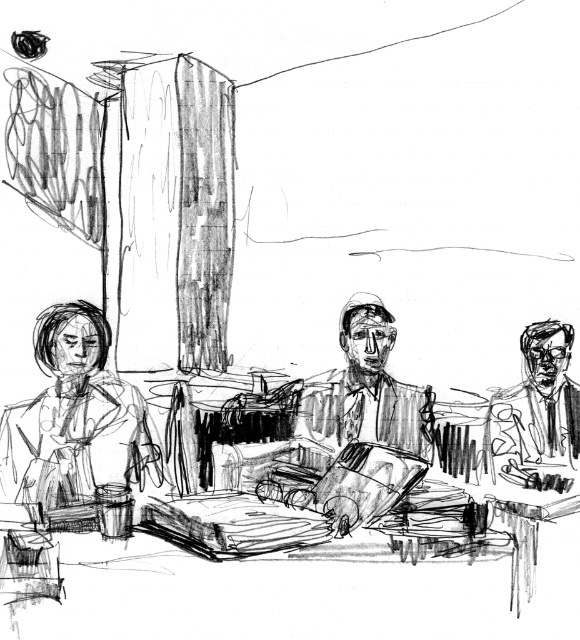
Question: Does smooth brown leather jacket at center lie behind smooth black suit at right?

Choices:
 (A) no
 (B) yes

Answer: (A)

Question: Considering the relative positions of smooth skin woman at left and smooth black suit at right in the image provided, where is smooth skin woman at left located with respect to smooth black suit at right?

Choices:
 (A) above
 (B) below

Answer: (B)

Question: Which point is closer to the camera?

Choices:
 (A) smooth brown leather jacket at center
 (B) smooth skin woman at left

Answer: (B)

Question: Which of the following is the farthest from the observer?

Choices:
 (A) smooth black suit at right
 (B) smooth skin woman at left

Answer: (A)

Question: Is smooth skin woman at left positioned behind smooth black suit at right?

Choices:
 (A) no
 (B) yes

Answer: (A)

Question: Which of the following is the closest to the observer?

Choices:
 (A) (394, 410)
 (B) (524, 413)
 (C) (89, 500)

Answer: (C)